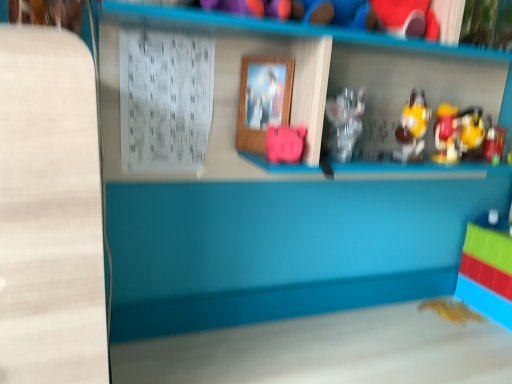
Question: Is pink matte piggy bank at center, arranged as the fourth toy when viewed from the top, at the back of wooden picture frame at center?

Choices:
 (A) yes
 (B) no

Answer: (B)

Question: Can you confirm if wooden picture frame at center is shorter than pink matte piggy bank at center, arranged as the fourth toy when viewed from the top?

Choices:
 (A) no
 (B) yes

Answer: (A)

Question: Can you confirm if wooden picture frame at center is thinner than pink matte piggy bank at center, which ranks as the 1th toy in left-to-right order?

Choices:
 (A) yes
 (B) no

Answer: (A)

Question: Is wooden picture frame at center at the left side of pink matte piggy bank at center, which is the third toy from bottom to top?

Choices:
 (A) yes
 (B) no

Answer: (A)

Question: Is pink matte piggy bank at center, which appears as the 6th toy when viewed from the right, surrounded by wooden picture frame at center?

Choices:
 (A) yes
 (B) no

Answer: (B)

Question: Is the depth of wooden picture frame at center less than that of pink matte piggy bank at center, which is the third toy from bottom to top?

Choices:
 (A) no
 (B) yes

Answer: (A)

Question: Does pink matte piggy bank at center, which appears as the 6th toy when viewed from the right, have a smaller size compared to wooden picture frame at center?

Choices:
 (A) yes
 (B) no

Answer: (B)

Question: From a real-world perspective, is pink matte piggy bank at center, which ranks as the 1th toy in left-to-right order, over wooden picture frame at center?

Choices:
 (A) yes
 (B) no

Answer: (B)

Question: Are pink matte piggy bank at center, which ranks as the 1th toy in left-to-right order, and wooden picture frame at center beside each other?

Choices:
 (A) yes
 (B) no

Answer: (B)

Question: Does pink matte piggy bank at center, arranged as the fourth toy when viewed from the top, have a lesser height compared to wooden picture frame at center?

Choices:
 (A) no
 (B) yes

Answer: (B)

Question: From the image's perspective, would you say pink matte piggy bank at center, which is the third toy from bottom to top, is shown under wooden picture frame at center?

Choices:
 (A) no
 (B) yes

Answer: (B)

Question: Is wooden picture frame at center a part of pink matte piggy bank at center, which is the third toy from bottom to top?

Choices:
 (A) yes
 (B) no

Answer: (B)

Question: Can you confirm if wooden picture frame at center is positioned to the right of gold metallic bat at lower right, which appears as the sixth toy when viewed from the top?

Choices:
 (A) yes
 (B) no

Answer: (B)